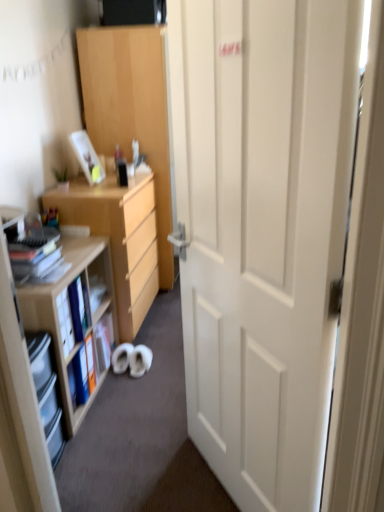
Question: Considering the relative positions of light wood cabinet at center and clear plastic shelves at left, the first shelf from the front, in the image provided, is light wood cabinet at center in front of clear plastic shelves at left, the first shelf from the front,?

Choices:
 (A) no
 (B) yes

Answer: (A)

Question: From the image's perspective, would you say light wood cabinet at center is positioned over clear plastic shelves at left, positioned as the second shelf in back-to-front order?

Choices:
 (A) yes
 (B) no

Answer: (A)

Question: Is light wood cabinet at center shorter than clear plastic shelves at left, the first shelf from the front?

Choices:
 (A) no
 (B) yes

Answer: (A)

Question: Does light wood cabinet at center contain clear plastic shelves at left, the first shelf from the front?

Choices:
 (A) yes
 (B) no

Answer: (B)

Question: Is clear plastic shelves at left, the first shelf from the front, at the back of light wood cabinet at center?

Choices:
 (A) no
 (B) yes

Answer: (A)

Question: From their relative heights in the image, would you say clear plastic shelves at left, the first shelf from the front, is taller or shorter than matte plastic picture frame at upper left?

Choices:
 (A) tall
 (B) short

Answer: (A)

Question: Is point (54, 429) positioned closer to the camera than point (79, 148)?

Choices:
 (A) farther
 (B) closer

Answer: (B)

Question: From the image's perspective, is clear plastic shelves at left, the first shelf from the front, located above or below matte plastic picture frame at upper left?

Choices:
 (A) above
 (B) below

Answer: (B)

Question: Is clear plastic shelves at left, positioned as the second shelf in back-to-front order, wider or thinner than matte plastic picture frame at upper left?

Choices:
 (A) wide
 (B) thin

Answer: (A)

Question: In terms of width, does white matte door at center look wider or thinner when compared to green matte plant at upper left?

Choices:
 (A) wide
 (B) thin

Answer: (A)

Question: Does point tap(246, 457) appear closer or farther from the camera than point tap(61, 170)?

Choices:
 (A) closer
 (B) farther

Answer: (A)

Question: Is white matte door at center taller or shorter than green matte plant at upper left?

Choices:
 (A) tall
 (B) short

Answer: (A)

Question: From a real-world perspective, relative to green matte plant at upper left, is white matte door at center vertically above or below?

Choices:
 (A) above
 (B) below

Answer: (B)

Question: Do you think light wood cabinet at center is within matte plastic picture frame at upper left, or outside of it?

Choices:
 (A) inside
 (B) outside

Answer: (B)

Question: Considering the relative positions of light wood cabinet at center and matte plastic picture frame at upper left in the image provided, is light wood cabinet at center to the left or to the right of matte plastic picture frame at upper left?

Choices:
 (A) left
 (B) right

Answer: (B)